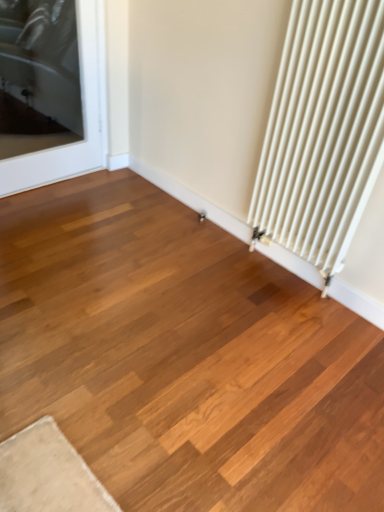
Question: Is white matte radiator at right positioned beyond the bounds of transparent glass door at upper left?

Choices:
 (A) yes
 (B) no

Answer: (A)

Question: From a real-world perspective, is white matte radiator at right positioned over transparent glass door at upper left based on gravity?

Choices:
 (A) no
 (B) yes

Answer: (B)

Question: Is white matte radiator at right oriented towards transparent glass door at upper left?

Choices:
 (A) no
 (B) yes

Answer: (A)

Question: Can you confirm if white matte radiator at right is shorter than transparent glass door at upper left?

Choices:
 (A) yes
 (B) no

Answer: (B)

Question: Is white matte radiator at right not close to transparent glass door at upper left?

Choices:
 (A) no
 (B) yes

Answer: (B)

Question: Does white matte radiator at right have a greater height compared to transparent glass door at upper left?

Choices:
 (A) yes
 (B) no

Answer: (A)

Question: Considering the relative positions of transparent glass door at upper left and white matte radiator at right in the image provided, is transparent glass door at upper left in front of white matte radiator at right?

Choices:
 (A) yes
 (B) no

Answer: (B)

Question: Can white matte radiator at right be found inside transparent glass door at upper left?

Choices:
 (A) no
 (B) yes

Answer: (A)

Question: Could you tell me if transparent glass door at upper left is turned towards white matte radiator at right?

Choices:
 (A) yes
 (B) no

Answer: (A)

Question: Is transparent glass door at upper left far away from white matte radiator at right?

Choices:
 (A) yes
 (B) no

Answer: (A)

Question: Is transparent glass door at upper left shorter than white matte radiator at right?

Choices:
 (A) yes
 (B) no

Answer: (A)

Question: Is transparent glass door at upper left to the left of white matte radiator at right from the viewer's perspective?

Choices:
 (A) no
 (B) yes

Answer: (B)

Question: Is point (304, 90) closer or farther from the camera than point (79, 28)?

Choices:
 (A) closer
 (B) farther

Answer: (A)